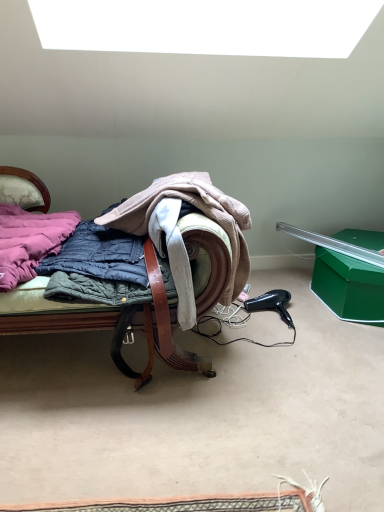
I want to click on vacant space in front of quilted fabric chair at center, so click(127, 440).